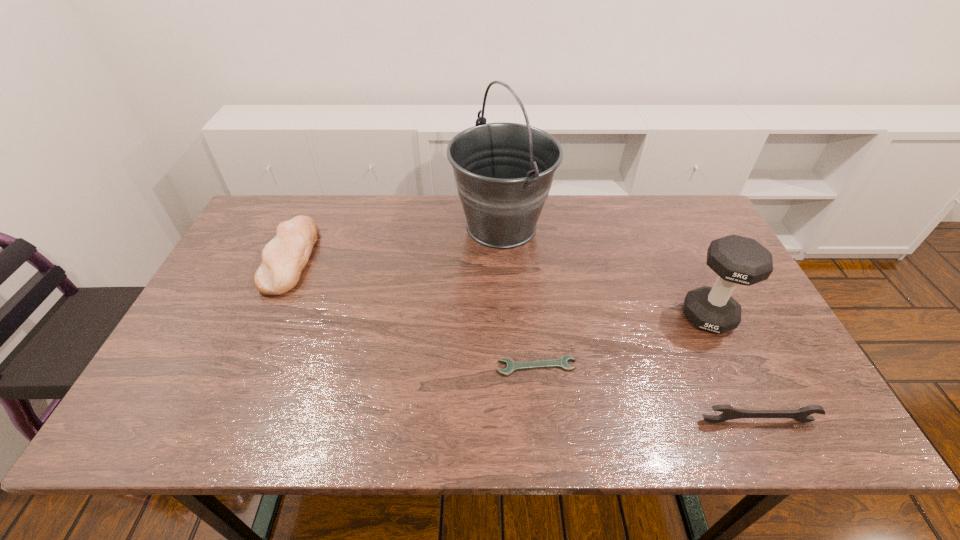
Find the location of a particular element. The image size is (960, 540). bucket is located at coordinates (503, 172).

This screenshot has width=960, height=540. Find the location of `dumbbell`. dumbbell is located at coordinates (740, 260).

What are the coordinates of `the third tallest object` in the screenshot? It's located at click(283, 258).

At what (x,y) coordinates should I click in order to perform the action: click on bread. Please return your answer as a coordinate pair (x, y). The width and height of the screenshot is (960, 540). Looking at the image, I should click on (283, 258).

Locate an element on the screen. This screenshot has height=540, width=960. the nearer wrench is located at coordinates (801, 415).

Where is `the second shortest object`? the second shortest object is located at coordinates (801, 415).

In order to click on the shortest object in this screenshot , I will do `click(512, 366)`.

The width and height of the screenshot is (960, 540). What are the coordinates of `the left wrench` in the screenshot? It's located at pos(512,366).

Where is `blank space located 0.240m on the right of the tallest object`? blank space located 0.240m on the right of the tallest object is located at coordinates (627, 226).

At what (x,y) coordinates should I click in order to perform the action: click on vacant space located 0.270m on the back of the fourth shortest object. Please return your answer as a coordinate pair (x, y). Looking at the image, I should click on (669, 234).